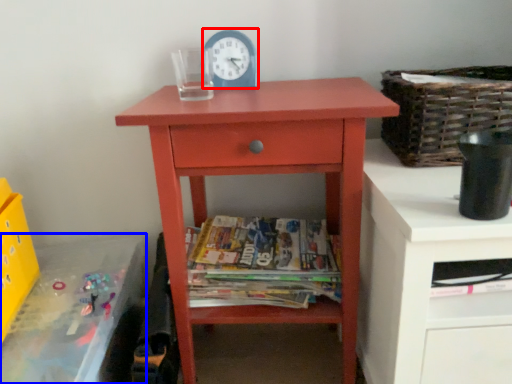
Question: Which of the following is the farthest to the observer, clock (highlighted by a red box) or changing table (highlighted by a blue box)?

Choices:
 (A) clock
 (B) changing table

Answer: (A)